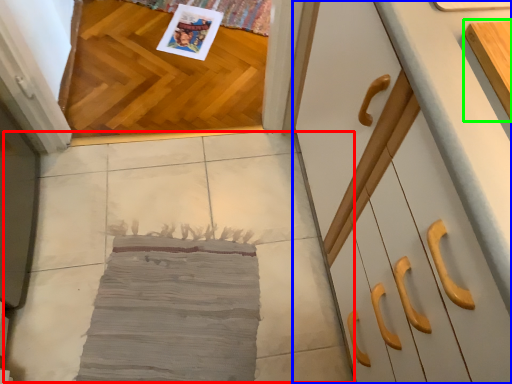
Question: Which is farther away from concrete (highlighted by a red box)? cabinetry (highlighted by a blue box) or cabinetry (highlighted by a green box)?

Choices:
 (A) cabinetry
 (B) cabinetry

Answer: (B)